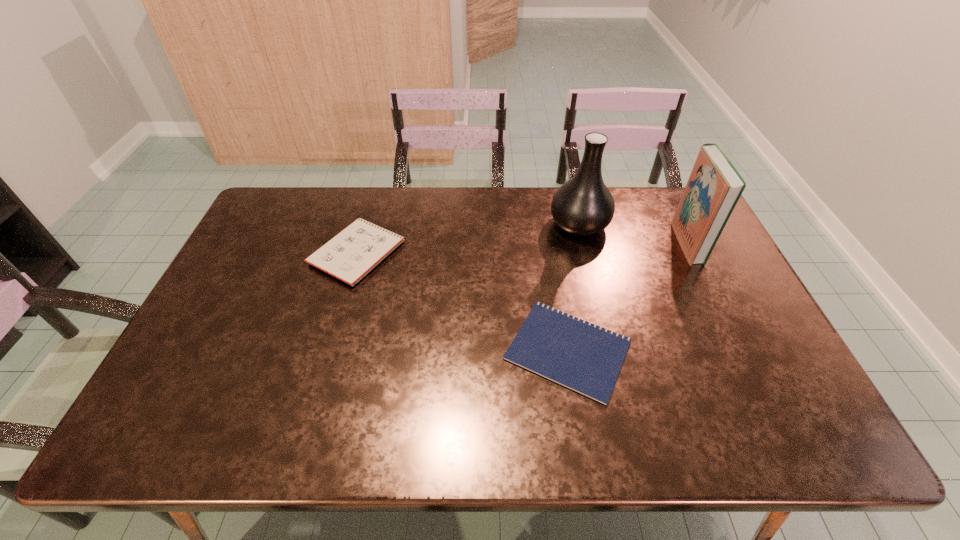
Find the location of a particular element. vase is located at coordinates (583, 206).

Image resolution: width=960 pixels, height=540 pixels. What are the coordinates of `the rightmost object` in the screenshot? It's located at (714, 187).

You are a GUI agent. You are given a task and a screenshot of the screen. Output one action in this format:
    pyautogui.click(x=<x>, y=<y>)
    Task: Click on the taller notepad
    
    Given the screenshot: What is the action you would take?
    pyautogui.click(x=351, y=254)

Find the location of a particular element. the left notepad is located at coordinates (351, 254).

You are a GUI agent. You are given a task and a screenshot of the screen. Output one action in this format:
    pyautogui.click(x=<x>, y=<y>)
    Task: Click on the nearer notepad
    
    Given the screenshot: What is the action you would take?
    pyautogui.click(x=581, y=356)

Identify the location of the shorter notepad. (581, 356).

At what (x,y) coordinates should I click in order to perform the action: click on vacant point located 0.190m on the front of the vase. Please return your answer as a coordinate pair (x, y). The width and height of the screenshot is (960, 540). Looking at the image, I should click on (595, 288).

Find the location of `vacant space positioned 0.050m on the cover of the hardback book`. vacant space positioned 0.050m on the cover of the hardback book is located at coordinates (662, 243).

In order to click on blank area located on the cover of the hardback book in this screenshot , I will do `click(637, 243)`.

Find the location of a particular element. The height and width of the screenshot is (540, 960). vacant space situated 0.310m on the cover of the hardback book is located at coordinates (582, 243).